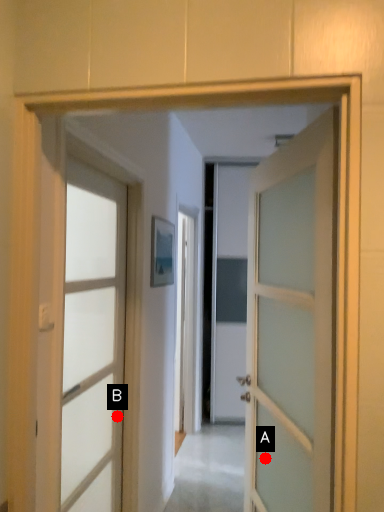
Question: Two points are circled on the image, labeled by A and B beside each circle. Which point is closer to the camera taking this photo?

Choices:
 (A) A is closer
 (B) B is closer

Answer: (A)